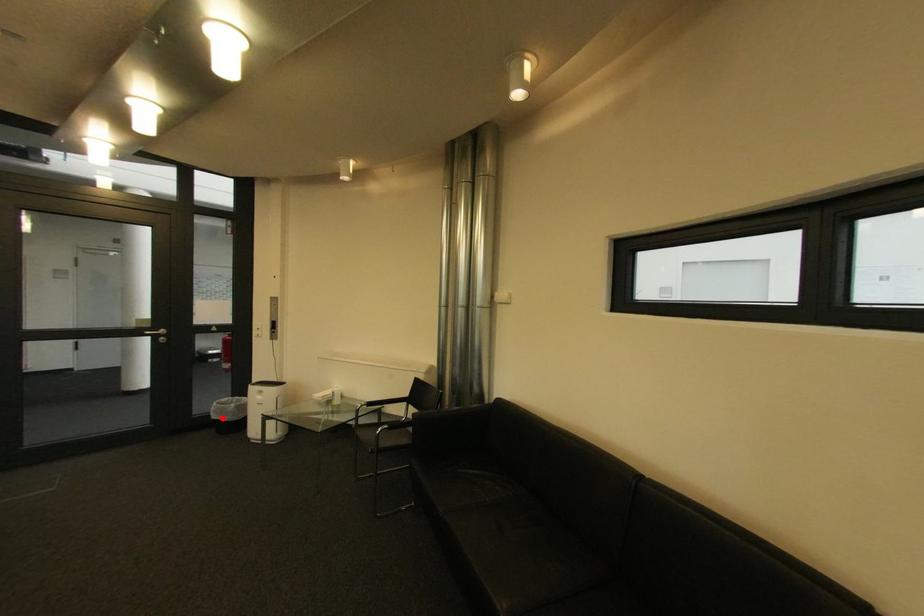
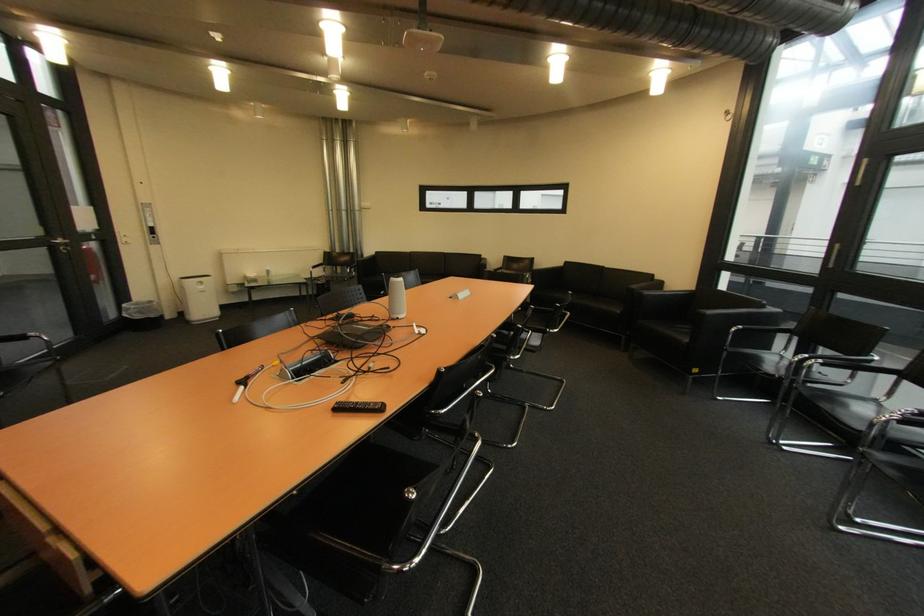
Find the pixel in the second image that matches the highlighted location in the first image.

(147, 318)